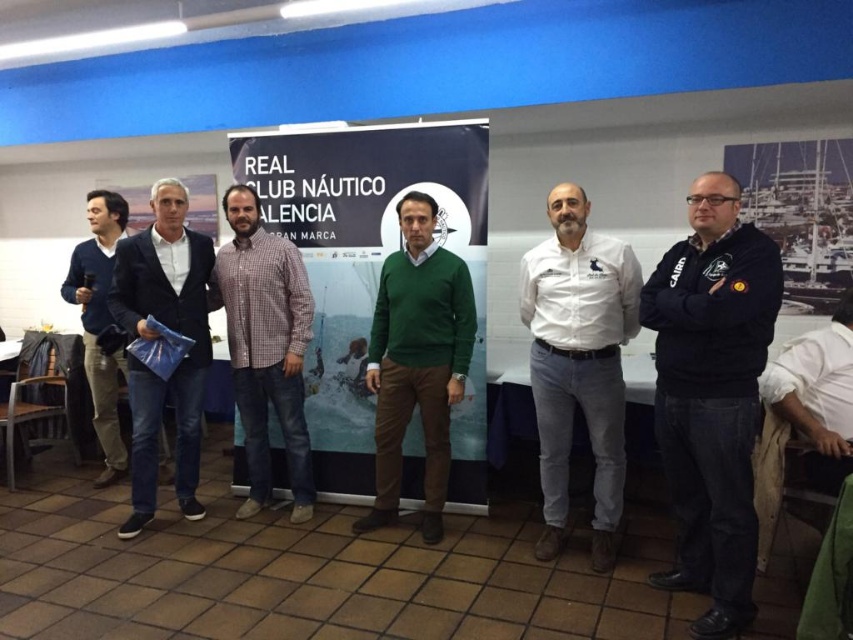
Can you confirm if white cotton shirt at center is positioned to the left of dark blue suit at center?

Incorrect, white cotton shirt at center is not on the left side of dark blue suit at center.

Who is more forward, (618, 403) or (183, 467)?

Positioned in front is point (618, 403).

Locate an element on the screen. The width and height of the screenshot is (853, 640). white cotton shirt at center is located at coordinates (578, 362).

Between green sweater at center and checkered fabric shirt at center, which one has more height?

Standing taller between the two is checkered fabric shirt at center.

In the scene shown: Is green sweater at center below checkered fabric shirt at center?

Yes, green sweater at center is below checkered fabric shirt at center.

What do you see at coordinates (416, 358) in the screenshot? I see `green sweater at center` at bounding box center [416, 358].

Identify the location of green sweater at center. The height and width of the screenshot is (640, 853). (416, 358).

The height and width of the screenshot is (640, 853). What do you see at coordinates (712, 396) in the screenshot?
I see `black fleece jacket at center` at bounding box center [712, 396].

Is point (755, 432) farther from viewer compared to point (548, 321)?

No, (755, 432) is in front of (548, 321).

The image size is (853, 640). Identify the location of black fleece jacket at center. (712, 396).